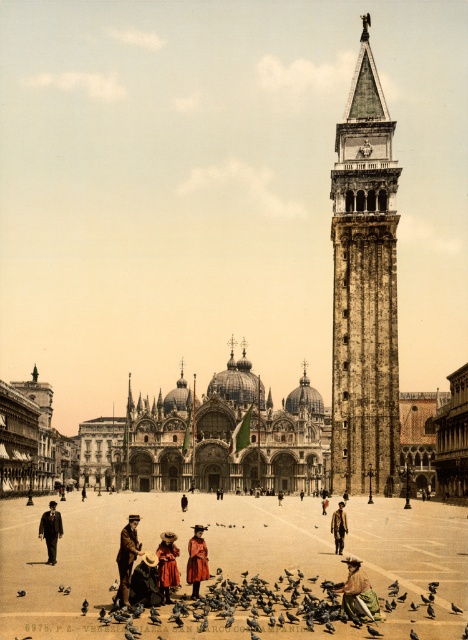
You are standing in St. Mark Square and see the brown leather coat at lower left. Where exactly is the brown leather coat located in relation to the Campanile di San Marco on the right side?

The brown leather coat at lower left is located at point (126, 556), which is to the left side of the Campanile di San Marco on the right side.

You are standing in St. Mark Square facing the Campanile di San Marco. You notice two points marked on the bell tower. One is at coordinate point (431, 577) and the other at point (125, 580). Which point is closer to you?

Point (125, 580) is closer to you because it is nearer to the viewer compared to point (431, 577).

You are standing in St. Mark Square in Venice, and you see the smooth sand town square at center and the brown leather coat at lower left. Which object is closer to the ground?

The smooth sand town square at center is positioned under brown leather coat at lower left, so the smooth sand town square at center is closer to the ground.